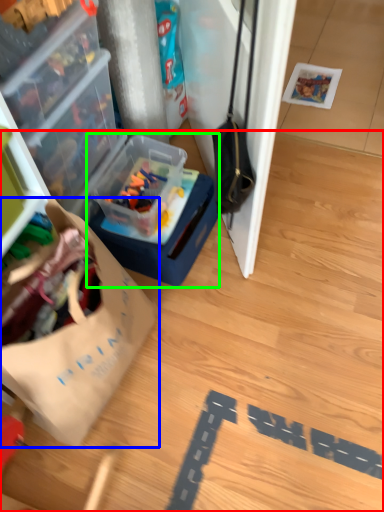
Question: Estimate the real-world distances between objects in this image. Which object is closer to wood (highlighted by a red box), wrapping paper (highlighted by a blue box) or box (highlighted by a green box)?

Choices:
 (A) wrapping paper
 (B) box

Answer: (B)